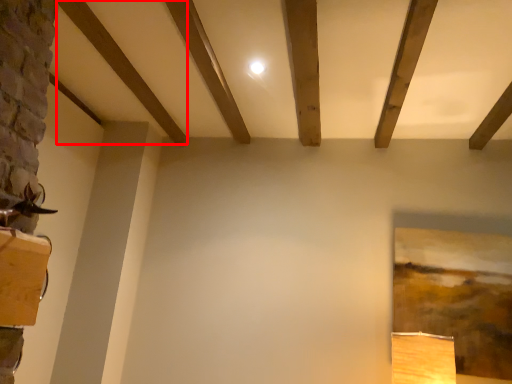
Question: Observing the image, what is the correct spatial positioning of plank (annotated by the red box) in reference to plank?

Choices:
 (A) left
 (B) right

Answer: (A)